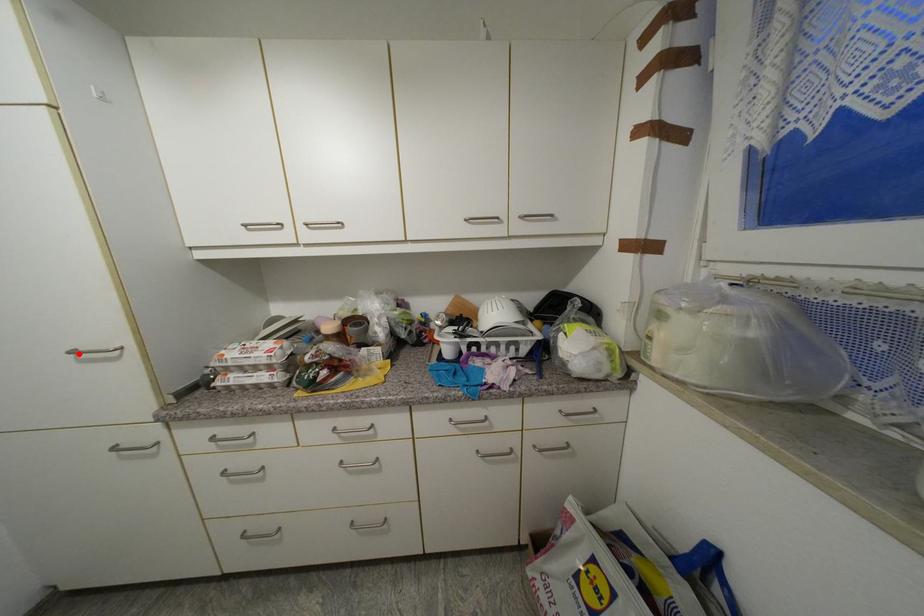
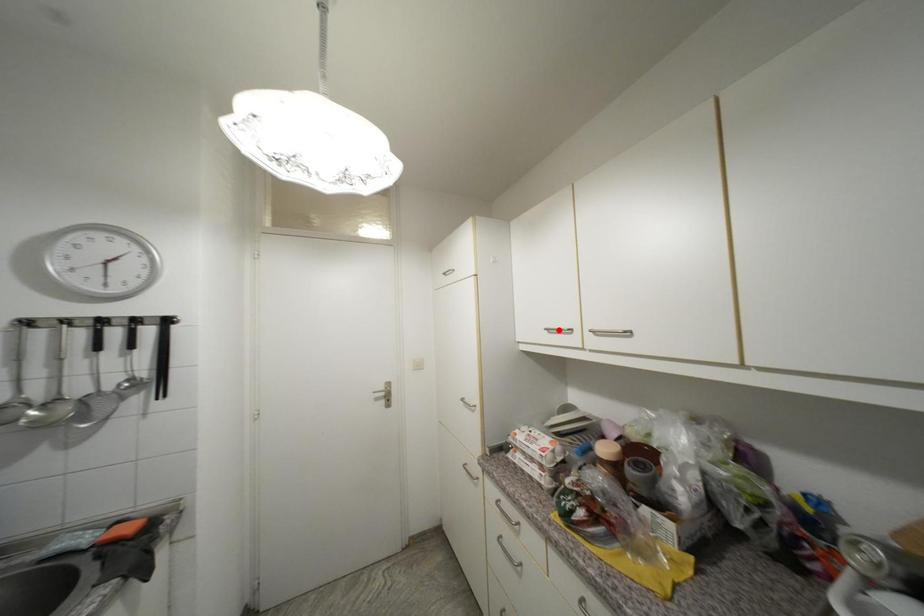
From the picture: I am providing you with two images of the same scene from different viewpoints. A red point is marked on the first image and another point is marked on the second image. Is the marked point in image1 the same physical position as the marked point in image2?

No